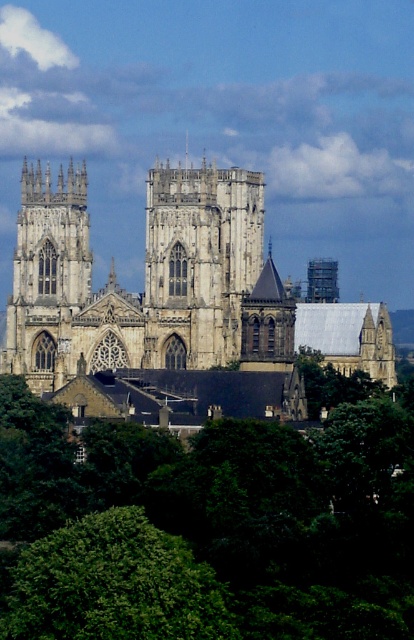
Question: Which object is farther from the camera taking this photo?

Choices:
 (A) stone church at center
 (B) green leafy tree at lower left
 (C) white stone tower at center

Answer: (C)

Question: Which of the following is the closest to the observer?

Choices:
 (A) (204, 360)
 (B) (72, 557)

Answer: (B)

Question: Is green leafy tree at lower center bigger than stone church at center?

Choices:
 (A) yes
 (B) no

Answer: (B)

Question: Can you confirm if stone church at center is smaller than green leafy tree at lower left?

Choices:
 (A) no
 (B) yes

Answer: (A)

Question: Based on their relative distances, which object is farther from the white stone tower at center?

Choices:
 (A) green leafy tree at lower left
 (B) stone church at center

Answer: (A)

Question: Where is green leafy tree at lower left located in relation to white stone tower at center in the image?

Choices:
 (A) left
 (B) right

Answer: (A)